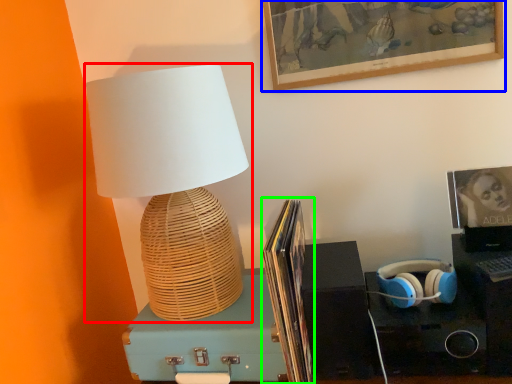
Question: Considering the real-world distances, which object is closest to lamp (highlighted by a red box)? picture frame (highlighted by a blue box) or book (highlighted by a green box).

Choices:
 (A) picture frame
 (B) book

Answer: (B)